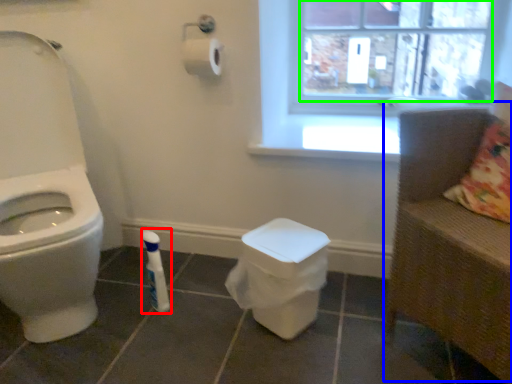
Question: Which object is the farthest from toiletry (highlighted by a red box)? Choose among these: armchair (highlighted by a blue box) or window screen (highlighted by a green box).

Choices:
 (A) armchair
 (B) window screen

Answer: (B)